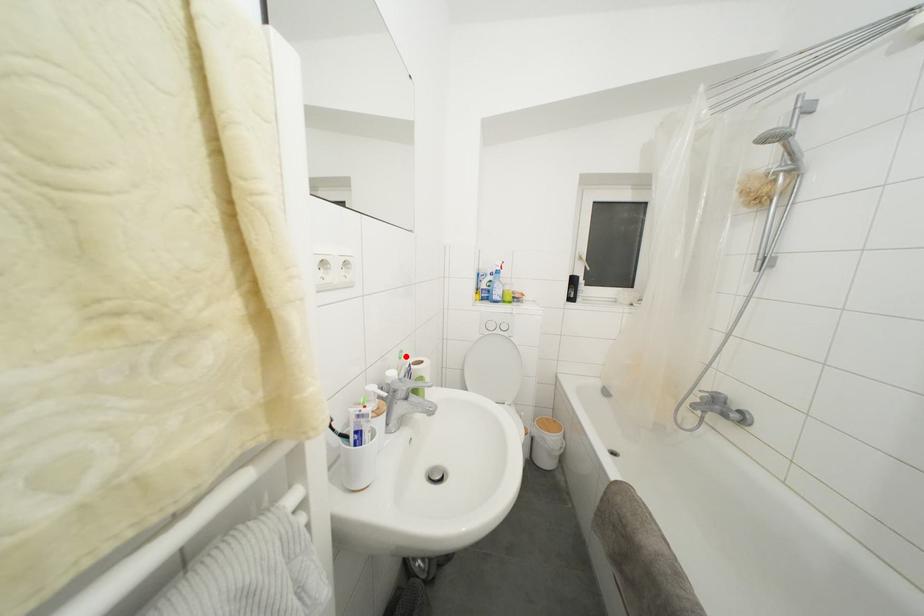
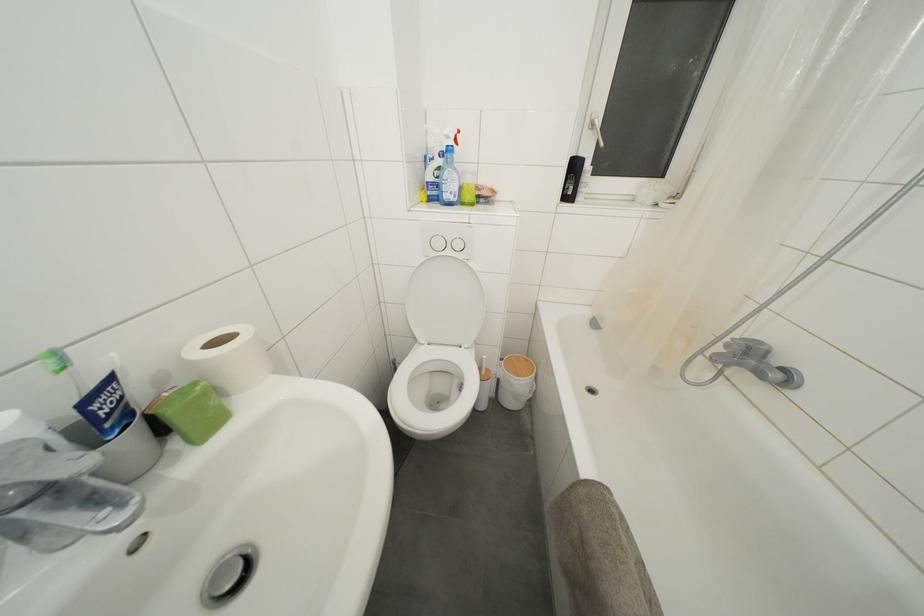
In the second image, find the point that corresponds to the highlighted location in the first image.

(61, 359)